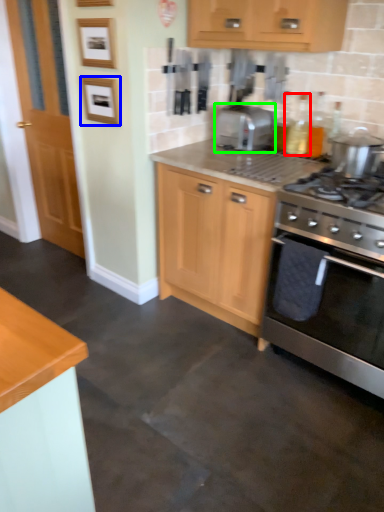
Question: Considering the real-world distances, which object is closest to bottle (highlighted by a red box)? picture frame (highlighted by a blue box) or toaster (highlighted by a green box).

Choices:
 (A) picture frame
 (B) toaster

Answer: (B)